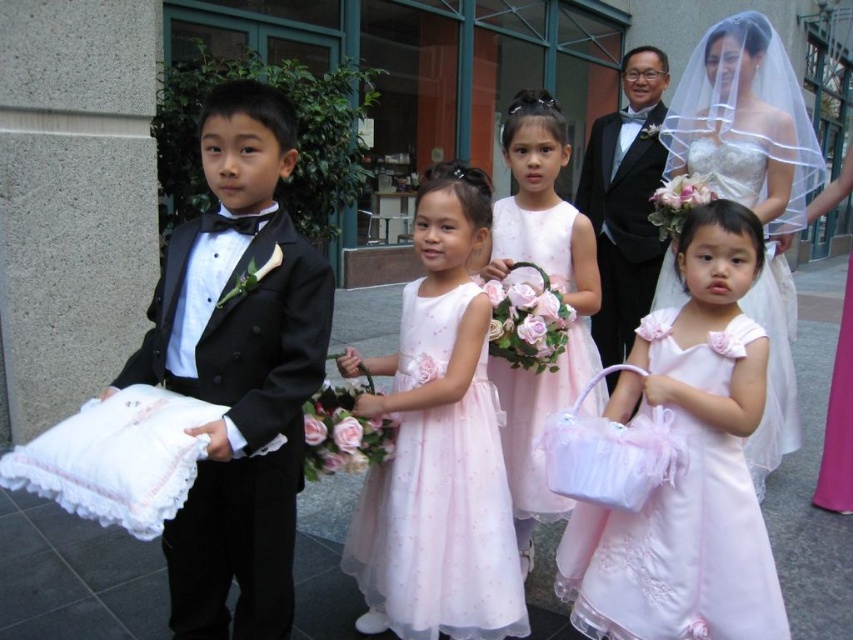
Who is more forward, (753, 40) or (503, 260)?

Point (503, 260) is in front.

Is satin white dress at upper center to the left of pastel pink tulle dress at center from the viewer's perspective?

No, satin white dress at upper center is not to the left of pastel pink tulle dress at center.

Locate an element on the screen. The width and height of the screenshot is (853, 640). satin white dress at upper center is located at coordinates (746, 124).

Is satin white dress at upper center above black satin tuxedo at center?

Incorrect, satin white dress at upper center is not positioned above black satin tuxedo at center.

Where is `satin white dress at upper center`? satin white dress at upper center is located at coordinates coord(746,124).

Is black satin tuxedo at left smaller than pink satin dress at lower right?

Actually, black satin tuxedo at left might be larger than pink satin dress at lower right.

Does black satin tuxedo at left have a greater width compared to pink satin dress at lower right?

No, black satin tuxedo at left is not wider than pink satin dress at lower right.

Measure the distance between black satin tuxedo at left and camera.

They are 4.26 feet apart.

Locate an element on the screen. The height and width of the screenshot is (640, 853). black satin tuxedo at left is located at coordinates (238, 369).